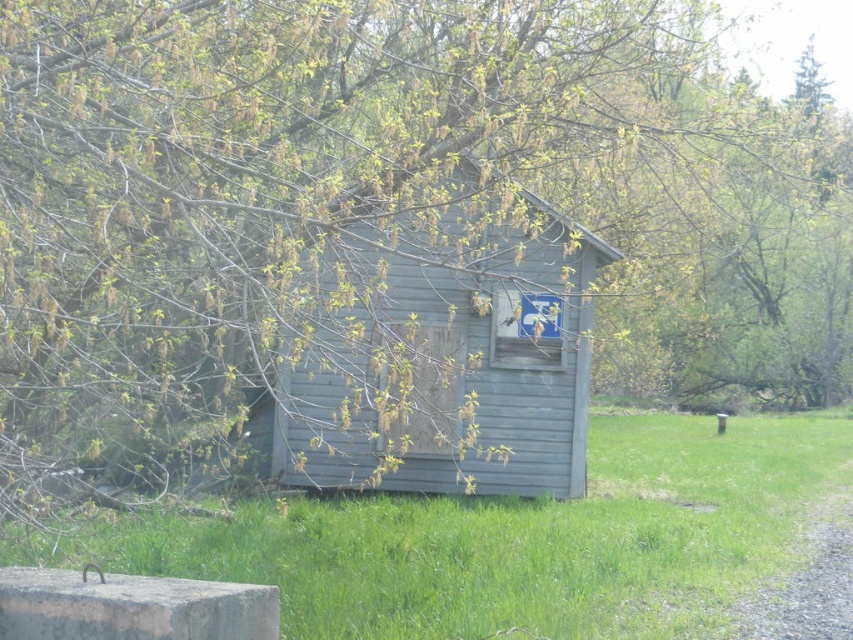
Is point (378, 568) farther from viewer compared to point (315, 468)?

That is False.

Who is taller, green grass at lower center or gray wood hut at center?

gray wood hut at center is taller.

Where is `green grass at lower center`? green grass at lower center is located at coordinates (515, 540).

This screenshot has height=640, width=853. In order to click on green grass at lower center in this screenshot , I will do `click(515, 540)`.